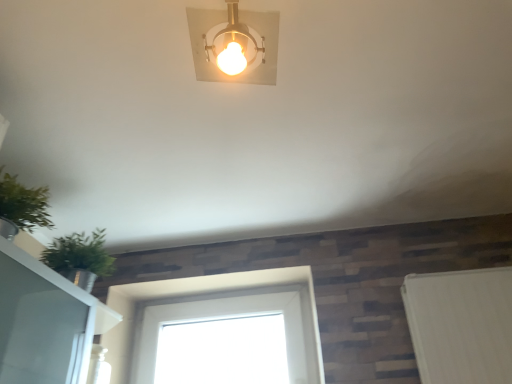
The height and width of the screenshot is (384, 512). I want to click on green leafy plant at left, so click(105, 318).

Measure the distance between green leafy plant at left and camera.

A distance of 4.28 feet exists between green leafy plant at left and camera.

Locate an element on the screen. The width and height of the screenshot is (512, 384). white glass window at center is located at coordinates (213, 316).

Is gold metallic light fixture at upper center facing towards green leafy plant at left?

No, gold metallic light fixture at upper center is not facing towards green leafy plant at left.

Does point (239, 24) come behind point (26, 240)?

No, it is not.

From a real-world perspective, which is physically above, gold metallic light fixture at upper center or green leafy plant at left?

gold metallic light fixture at upper center.

From the image's perspective, is green leafy plant at left above or below white glass window at center?

Clearly, from the image's perspective, green leafy plant at left is above white glass window at center.

Based on the photo, is green leafy plant at left beside white glass window at center?

They are not placed beside each other.

Is the position of green leafy plant at left less distant than that of white glass window at center?

Yes, it is.

How far apart are green leafy plant at left and white glass window at center?

green leafy plant at left and white glass window at center are 17.74 inches apart from each other.

What's the angular difference between green leafy plant at left and gold metallic light fixture at upper center's facing directions?

10.6 degrees separate the facing orientations of green leafy plant at left and gold metallic light fixture at upper center.

Considering the sizes of objects green leafy plant at left and gold metallic light fixture at upper center in the image provided, who is bigger, green leafy plant at left or gold metallic light fixture at upper center?

green leafy plant at left is bigger.

Is green leafy plant at left not within gold metallic light fixture at upper center?

green leafy plant at left lies outside gold metallic light fixture at upper center's area.

Does point (237, 310) appear closer or farther from the camera than point (234, 45)?

Point (237, 310) appears to be farther away from the viewer than point (234, 45).

Relative to gold metallic light fixture at upper center, is white glass window at center in front or behind?

white glass window at center is behind gold metallic light fixture at upper center.

From the picture: How distant is white glass window at center from gold metallic light fixture at upper center?

white glass window at center is 1.13 meters from gold metallic light fixture at upper center.

Considering the sizes of white glass window at center and gold metallic light fixture at upper center in the image, is white glass window at center taller or shorter than gold metallic light fixture at upper center?

Clearly, white glass window at center is taller compared to gold metallic light fixture at upper center.

From the image's perspective, which is below, white glass window at center or green leafy plant at left?

white glass window at center appears lower in the image.

In the scene shown: Relative to green leafy plant at left, is white glass window at center in front or behind?

In the image, white glass window at center appears behind green leafy plant at left.

Is white glass window at center not near green leafy plant at left?

Actually, white glass window at center and green leafy plant at left are a little close together.

Is white glass window at center aimed at green leafy plant at left?

Yes, white glass window at center faces towards green leafy plant at left.

Considering the relative sizes of gold metallic light fixture at upper center and white glass window at center in the image provided, is gold metallic light fixture at upper center taller than white glass window at center?

No, gold metallic light fixture at upper center is not taller than white glass window at center.

Does gold metallic light fixture at upper center appear on the right side of white glass window at center?

Correct, you'll find gold metallic light fixture at upper center to the right of white glass window at center.

Considering the points (211, 19) and (294, 350), which point is behind, point (211, 19) or point (294, 350)?

The point (294, 350) is farther from the camera.

From a real-world perspective, between gold metallic light fixture at upper center and white glass window at center, who is vertically higher?

From a 3D spatial view, gold metallic light fixture at upper center is above.

You are a GUI agent. You are given a task and a screenshot of the screen. Output one action in this format:
    pyautogui.click(x=<x>, y=<y>)
    Task: Click on the window sill behind the gold metallic light fixture at upper center
    The image size is (512, 384).
    Given the screenshot: What is the action you would take?
    pyautogui.click(x=105, y=318)

Locate an element on the screen. Image resolution: width=512 pixels, height=384 pixels. window sill on the left of the white glass window at center is located at coordinates (105, 318).

Based on their spatial positions, is white glass window at center or green leafy plant at left further from gold metallic light fixture at upper center?

The object further to gold metallic light fixture at upper center is white glass window at center.

From the image, which object appears to be nearer to white glass window at center, gold metallic light fixture at upper center or green leafy plant at left?

Result: The object closer to white glass window at center is green leafy plant at left.

Looking at the image, which one is located further to green leafy plant at left, gold metallic light fixture at upper center or white glass window at center?

Among the two, gold metallic light fixture at upper center is located further to green leafy plant at left.

Based on their spatial positions, is green leafy plant at left or gold metallic light fixture at upper center further from white glass window at center?

gold metallic light fixture at upper center.

Based on their spatial positions, is white glass window at center or gold metallic light fixture at upper center closer to green leafy plant at left?

white glass window at center is positioned closer to the anchor green leafy plant at left.

Looking at the image, which one is located closer to gold metallic light fixture at upper center, green leafy plant at left or white glass window at center?

green leafy plant at left is closer to gold metallic light fixture at upper center.

Locate an element on the screen. This screenshot has width=512, height=384. window sill between gold metallic light fixture at upper center and white glass window at center along the z-axis is located at coordinates (105, 318).